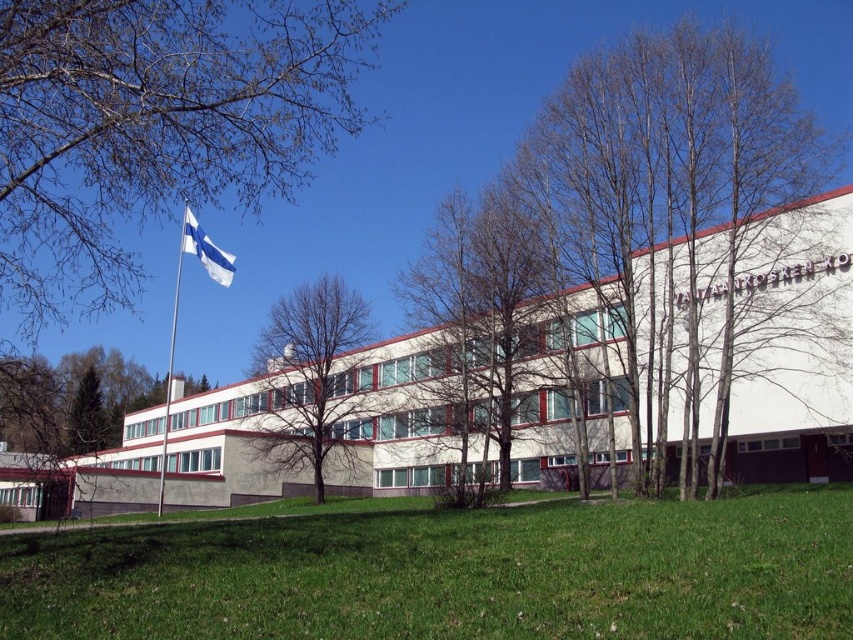
You are a landscape architect designing a new garden. You have two elements to place in your design based on the scene you observed. The green grass at lower center and the bare branches at upper left. Which element should you choose if you want a smaller feature in your garden?

The green grass at lower center has a smaller size compared to the bare branches at upper left, so you should choose the green grass at lower center for a smaller feature in your garden.